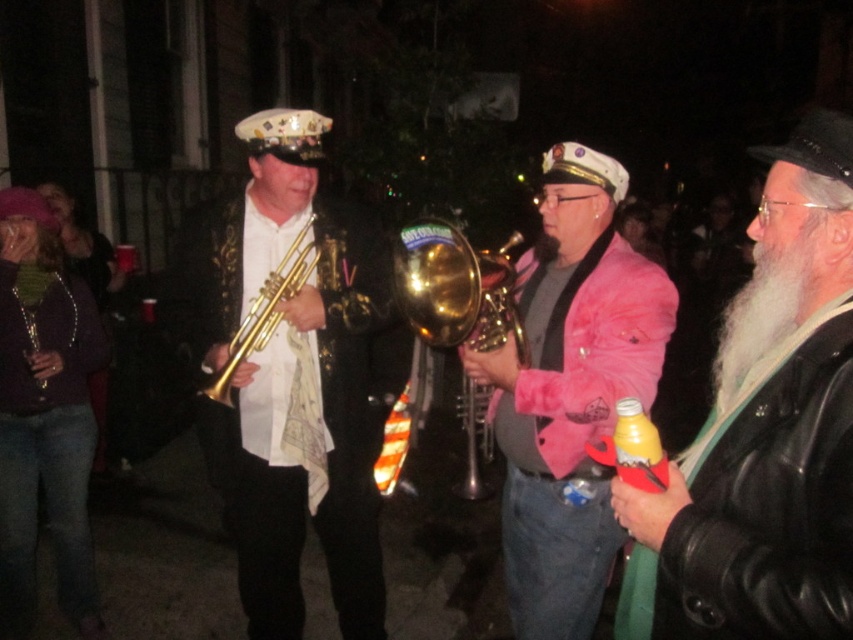
Which is more to the right, white beard at right or pink fuzzy jacket at center?

Positioned to the right is white beard at right.

Based on the photo, between white beard at right and pink fuzzy jacket at center, which one is positioned lower?

Positioned lower is pink fuzzy jacket at center.

Between point (843, 442) and point (656, 284), which one is positioned in front?

Point (843, 442) is in front.

This screenshot has width=853, height=640. In order to click on white beard at right in this screenshot , I will do `click(764, 432)`.

Can you confirm if gold shiny trumpet at center is positioned to the right of white fuzzy beard at right?

Incorrect, gold shiny trumpet at center is not on the right side of white fuzzy beard at right.

Between gold shiny trumpet at center and white fuzzy beard at right, which one is positioned lower?

white fuzzy beard at right

The width and height of the screenshot is (853, 640). I want to click on gold shiny trumpet at center, so 456,289.

Is gold shiny trumpet at left wider than white fuzzy beard at right?

Correct, the width of gold shiny trumpet at left exceeds that of white fuzzy beard at right.

Who is more distant from viewer, [364,314] or [722,358]?

The point [364,314] is behind.

Where is `gold shiny trumpet at left`? gold shiny trumpet at left is located at coordinates (296, 385).